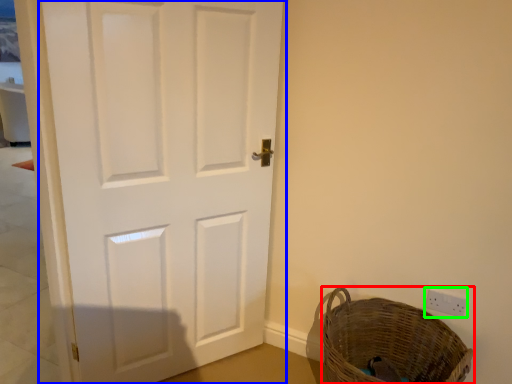
Question: Estimate the real-world distances between objects in this image. Which object is closer to basket (highlighted by a red box), door (highlighted by a blue box) or electric outlet (highlighted by a green box)?

Choices:
 (A) door
 (B) electric outlet

Answer: (B)